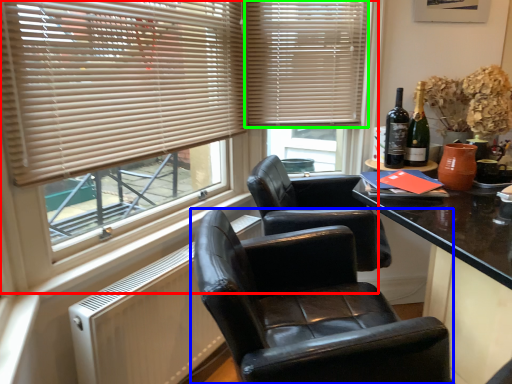
Question: Based on their relative distances, which object is farther from window (highlighted by a red box)? Choose from chair (highlighted by a blue box) and window blind (highlighted by a green box).

Choices:
 (A) chair
 (B) window blind

Answer: (A)